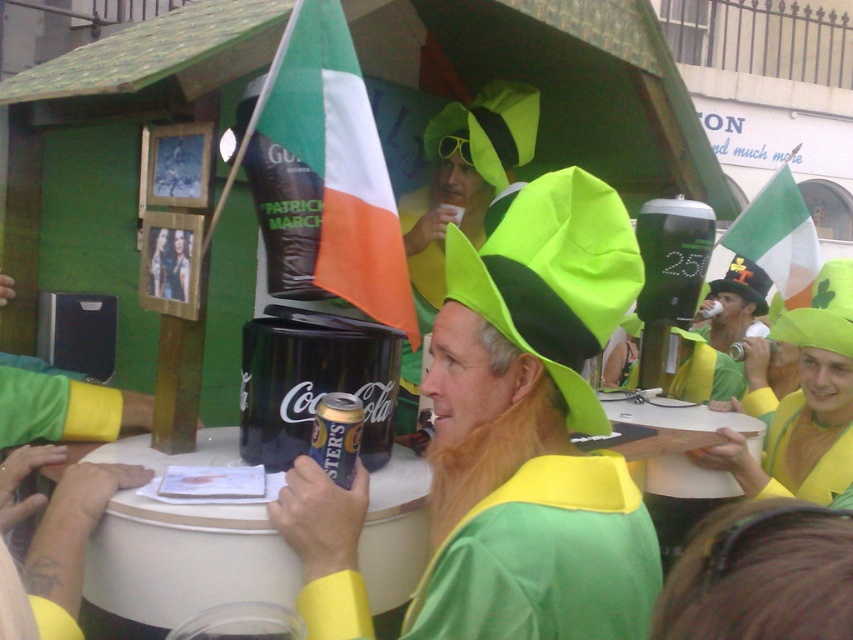
You are a photographer at the event and want to take a photo of the Guinness sign and the black plastic can at center. Where should you position yourself to include both in the frame?

Position yourself so that the black plastic can at center is at the center of the frame, as it is located at point (312, 381), which is near the center. This will also capture the Guinness sign in the background.

You are a photographer standing at the event. You want to take a photo of the black plastic can at center without any people in the frame. The people are currently 2 meters away from the can. Can you move closer to the can to capture the shot?

The black plastic can at center is 1.56 meters away from the camera. Since the people are 2 meters away from the can, moving closer to the can would bring you within 1.56 meters, which is the distance from the camera to the can. However, this might place you between the camera and the can, potentially blocking the shot. Alternatively, moving to the side could allow you to capture the can while avoiding people, but the exact feasibility depends on the arrangement of the scene.

Looking at this image, you are a guest at the event and want to place a 1.2 meter long cake on the white plastic table at center. Is there enough space for the cake?

The distance between the white plastic table at center and the viewer is 1.34 meters, but this measurement does not indicate the table size. Without knowing the table dimensions, it is impossible to determine if the cake will fit.